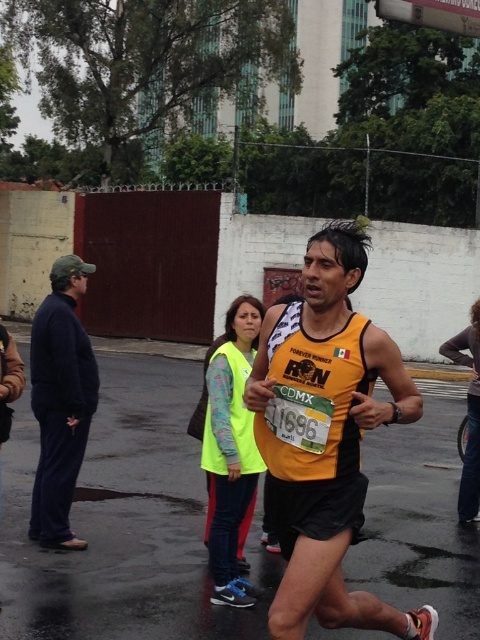
You are a photographer at the marathon event. You want to take a photo of the yellow fabric tank top at center and the dark blue fleece at left. Which object should you focus on first to ensure both are in sharp focus?

The yellow fabric tank top at center is closer to the viewer than the dark blue fleece at left. To ensure both are in sharp focus, you should focus on the yellow fabric tank top at center first, as it is closer, and the depth of field will extend to the background object.

You are a photographer positioned at point (60, 401). You want to capture a photo of the male runner wearing yellow tank top with text

At point (60, 401) lies dark blue fleece at left, so you cannot capture the male runner wearing yellow tank top with text as the dark blue fleece is blocking your view.